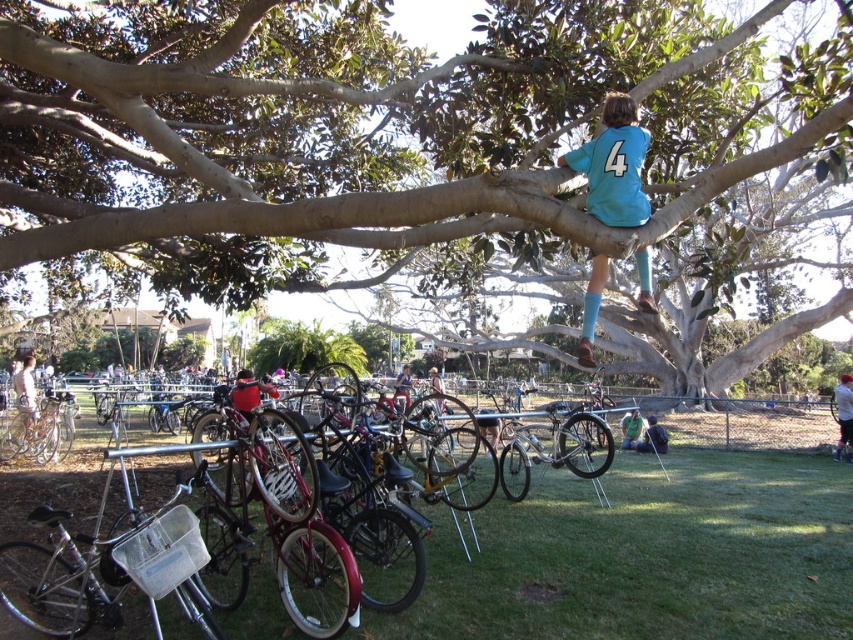
Question: Does brown rough tree at upper center have a lesser width compared to metallic silver bicycle at center?

Choices:
 (A) yes
 (B) no

Answer: (B)

Question: Estimate the real-world distances between objects in this image. Which object is farther from the brown rough tree at upper center?

Choices:
 (A) teal jersey at upper right
 (B) metallic silver bicycle at center

Answer: (B)

Question: Which is farther from the brown rough tree at upper center?

Choices:
 (A) teal jersey at upper right
 (B) metallic silver bicycle at center

Answer: (B)

Question: Among these points, which one is nearest to the camera?

Choices:
 (A) (563, 156)
 (B) (289, 612)
 (C) (368, 216)

Answer: (C)

Question: Can you confirm if metallic silver bicycle at center is positioned above teal jersey at upper right?

Choices:
 (A) yes
 (B) no

Answer: (B)

Question: Can you confirm if brown rough tree at upper center is positioned below teal jersey at upper right?

Choices:
 (A) no
 (B) yes

Answer: (A)